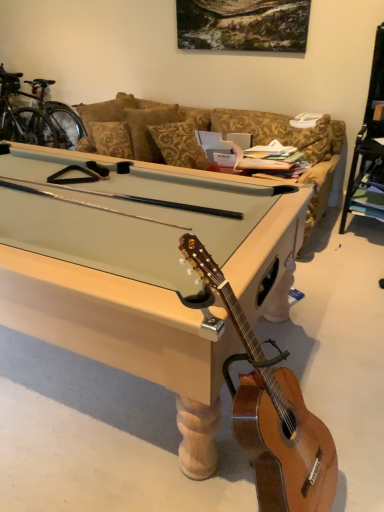
This screenshot has height=512, width=384. I want to click on free location to the left of light brown wood guitar at lower right, so click(x=163, y=467).